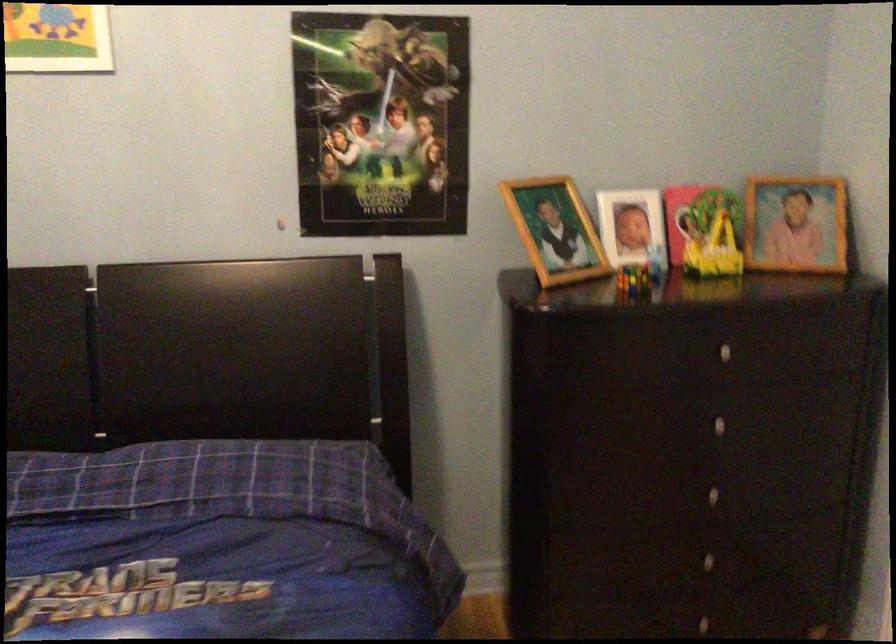
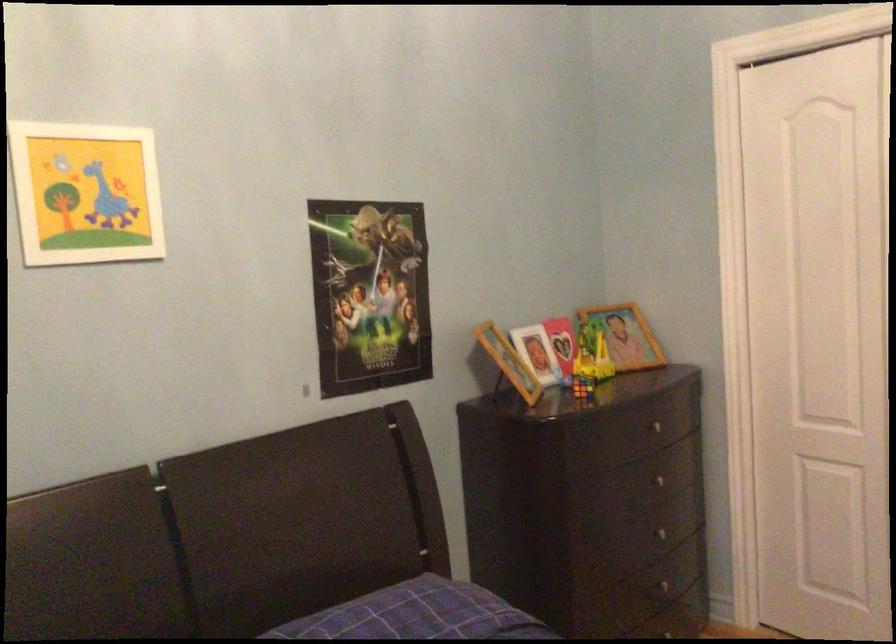
In the second image, find the point that corresponds to point (382, 131) in the first image.

(369, 294)